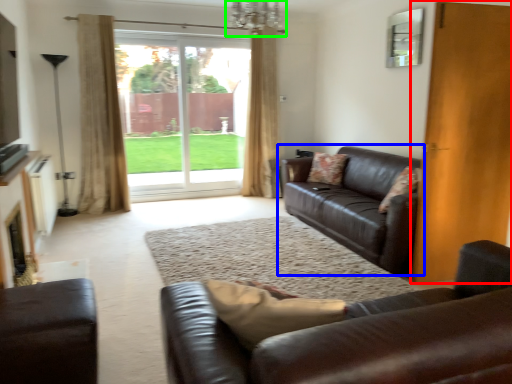
Question: Based on their relative distances, which object is farther from door (highlighted by a red box)? Choose from studio couch (highlighted by a blue box) and chandelier (highlighted by a green box).

Choices:
 (A) studio couch
 (B) chandelier

Answer: (B)